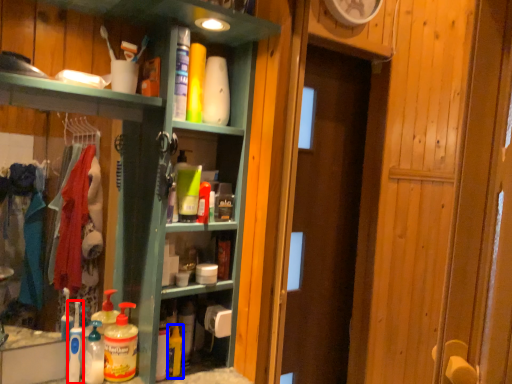
Question: Which object is closer to the camera taking this photo, cleaning product (highlighted by a red box) or cleaning product (highlighted by a blue box)?

Choices:
 (A) cleaning product
 (B) cleaning product

Answer: (A)